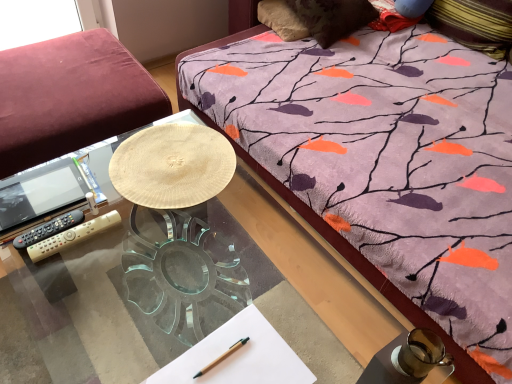
Measure the distance between point (185, 117) and camera.

Point (185, 117) is 4.68 feet from camera.

What do you see at coordinates (222, 357) in the screenshot? I see `wooden pen at lower center` at bounding box center [222, 357].

Measure the distance between white paper at center and camera.

They are 82.90 centimeters apart.

This screenshot has height=384, width=512. What do you see at coordinates (475, 24) in the screenshot?
I see `purple fabric pillow at upper right, which ranks as the 1th pillow in right-to-left order` at bounding box center [475, 24].

Identify the location of velvet burgundy studio couch at left. Image resolution: width=512 pixels, height=384 pixels. (71, 97).

From the image's perspective, is black plastic remote control at left, acting as the first remote control starting from the left, located above or below white paper at center?

From the image's perspective, black plastic remote control at left, acting as the first remote control starting from the left, appears above white paper at center.

Is black plastic remote control at left, the second remote control in the right-to-left sequence, surrounding white paper at center?

No, white paper at center is located outside of black plastic remote control at left, the second remote control in the right-to-left sequence.

Considering the positions of point (81, 222) and point (243, 355), is point (81, 222) closer or farther from the camera than point (243, 355)?

Point (81, 222) appears to be farther away from the viewer than point (243, 355).

Would you consider white paper at center to be distant from wooden pen at lower center?

No, white paper at center is not far from wooden pen at lower center.

In the scene shown: Which object is wider, white paper at center or wooden pen at lower center?

Wider between the two is white paper at center.

Can you confirm if white paper at center is bigger than wooden pen at lower center?

Yes.

Considering the relative sizes of velvet burgundy studio couch at left and wooden pen at lower center in the image provided, is velvet burgundy studio couch at left wider than wooden pen at lower center?

Yes, velvet burgundy studio couch at left is wider than wooden pen at lower center.

In the image, is velvet burgundy studio couch at left on the left side or the right side of wooden pen at lower center?

From the image, it's evident that velvet burgundy studio couch at left is to the left of wooden pen at lower center.

Do you think velvet burgundy studio couch at left is within wooden pen at lower center, or outside of it?

velvet burgundy studio couch at left is located beyond the bounds of wooden pen at lower center.

From a real-world perspective, is velvet burgundy studio couch at left positioned over wooden pen at lower center based on gravity?

Incorrect, from a real-world perspective, velvet burgundy studio couch at left is lower than wooden pen at lower center.

Considering the relative sizes of purple fabric pillow at upper right, which ranks as the 1th pillow in right-to-left order, and white paper at center in the image provided, is purple fabric pillow at upper right, which ranks as the 1th pillow in right-to-left order, thinner than white paper at center?

Incorrect, the width of purple fabric pillow at upper right, which ranks as the 1th pillow in right-to-left order, is not less than that of white paper at center.

Looking at this image, is the surface of purple fabric pillow at upper right, which ranks as the 1th pillow in right-to-left order, in direct contact with white paper at center?

They are not placed beside each other.

From their relative heights in the image, would you say purple fabric pillow at upper right, which ranks as the 1th pillow in right-to-left order, is taller or shorter than white paper at center?

In the image, purple fabric pillow at upper right, which ranks as the 1th pillow in right-to-left order, appears to be taller than white paper at center.

Are velvet burgundy studio couch at left and gold plastic remote control at lower left, placed as the 2th remote control when sorted from left to right, far apart?

They are positioned close to each other.

Is velvet burgundy studio couch at left turned away from gold plastic remote control at lower left, acting as the first remote control starting from the right?

velvet burgundy studio couch at left does not have its back to gold plastic remote control at lower left, acting as the first remote control starting from the right.

Does velvet burgundy studio couch at left appear on the right side of gold plastic remote control at lower left, placed as the 2th remote control when sorted from left to right?

No, velvet burgundy studio couch at left is not to the right of gold plastic remote control at lower left, placed as the 2th remote control when sorted from left to right.

Between velvet burgundy studio couch at left and gold plastic remote control at lower left, acting as the first remote control starting from the right, which one has smaller size?

With smaller size is gold plastic remote control at lower left, acting as the first remote control starting from the right.

Is transparent glass desk at center to the right of white paper at center from the viewer's perspective?

In fact, transparent glass desk at center is to the left of white paper at center.

Can you confirm if transparent glass desk at center is bigger than white paper at center?

Correct, transparent glass desk at center is larger in size than white paper at center.

Which is in front, transparent glass desk at center or white paper at center?

white paper at center is closer to the camera.

From the picture: Are transparent glass desk at center and white paper at center making contact?

No.

Between white paper at center and velvet burgundy studio couch at left, which one has smaller width?

white paper at center is thinner.

Is white paper at center touching velvet burgundy studio couch at left?

No, white paper at center is not in contact with velvet burgundy studio couch at left.

From a real-world perspective, is white paper at center above or below velvet burgundy studio couch at left?

From a real-world perspective, white paper at center is physically above velvet burgundy studio couch at left.

Is white paper at center facing away from velvet burgundy studio couch at left?

No.

This screenshot has height=384, width=512. In order to click on notepad on the right side of black plastic remote control at left, the second remote control in the right-to-left sequence in this screenshot , I will do `click(239, 356)`.

Where is `pen behind the white paper at center`? The height and width of the screenshot is (384, 512). pen behind the white paper at center is located at coordinates (222, 357).

Which object lies further to the anchor point transparent glass desk at center, black plastic remote control at left, acting as the first remote control starting from the left, or purple fabric pillow at upper right, which ranks as the 1th pillow in right-to-left order?

purple fabric pillow at upper right, which ranks as the 1th pillow in right-to-left order, is further to transparent glass desk at center.

Considering their positions, is transparent glass desk at center positioned further to suede-like brown pillow at upper center, the 1th pillow in the left-to-right sequence, than gold plastic remote control at lower left, placed as the 2th remote control when sorted from left to right?

gold plastic remote control at lower left, placed as the 2th remote control when sorted from left to right, is further to suede-like brown pillow at upper center, the 1th pillow in the left-to-right sequence.

Considering their positions, is suede-like brown pillow at upper center, the 1th pillow in the left-to-right sequence, positioned closer to transparent glass desk at center than white paper at center?

Among the two, white paper at center is located nearer to transparent glass desk at center.

Looking at the image, which one is located closer to gold plastic remote control at lower left, acting as the first remote control starting from the right, velvet burgundy studio couch at left or black plastic remote control at left, the second remote control in the right-to-left sequence?

The object closer to gold plastic remote control at lower left, acting as the first remote control starting from the right, is black plastic remote control at left, the second remote control in the right-to-left sequence.

Estimate the real-world distances between objects in this image. Which object is closer to black plastic remote control at left, acting as the first remote control starting from the left, gold plastic remote control at lower left, acting as the first remote control starting from the right, or transparent glass desk at center?

gold plastic remote control at lower left, acting as the first remote control starting from the right, is positioned closer to the anchor black plastic remote control at left, acting as the first remote control starting from the left.

From the image, which object appears to be nearer to white paper at center, suede-like brown pillow at upper center, which is the 2th pillow from right to left, or purple fabric pillow at upper right, which ranks as the 1th pillow in right-to-left order?

The object closer to white paper at center is suede-like brown pillow at upper center, which is the 2th pillow from right to left.

When comparing their distances from velvet burgundy studio couch at left, does white paper at center or suede-like brown pillow at upper center, the 1th pillow in the left-to-right sequence, seem further?

white paper at center is positioned further to the anchor velvet burgundy studio couch at left.

Estimate the real-world distances between objects in this image. Which object is closer to suede-like brown pillow at upper center, the 1th pillow in the left-to-right sequence, wooden pen at lower center or gold plastic remote control at lower left, placed as the 2th remote control when sorted from left to right?

The object closer to suede-like brown pillow at upper center, the 1th pillow in the left-to-right sequence, is gold plastic remote control at lower left, placed as the 2th remote control when sorted from left to right.

The height and width of the screenshot is (384, 512). Identify the location of desk between velvet burgundy studio couch at left and purple fabric pillow at upper right, the 2th pillow viewed from the left. (184, 295).

Locate an element on the screen. Image resolution: width=512 pixels, height=384 pixels. desk located between gold plastic remote control at lower left, acting as the first remote control starting from the right, and wooden pen at lower center in the left-right direction is located at coordinates (184, 295).

I want to click on desk situated between black plastic remote control at left, acting as the first remote control starting from the left, and white paper at center from left to right, so click(x=184, y=295).

The height and width of the screenshot is (384, 512). Identify the location of desk between suede-like brown pillow at upper center, which is the 2th pillow from right to left, and wooden pen at lower center in the up-down direction. (184, 295).